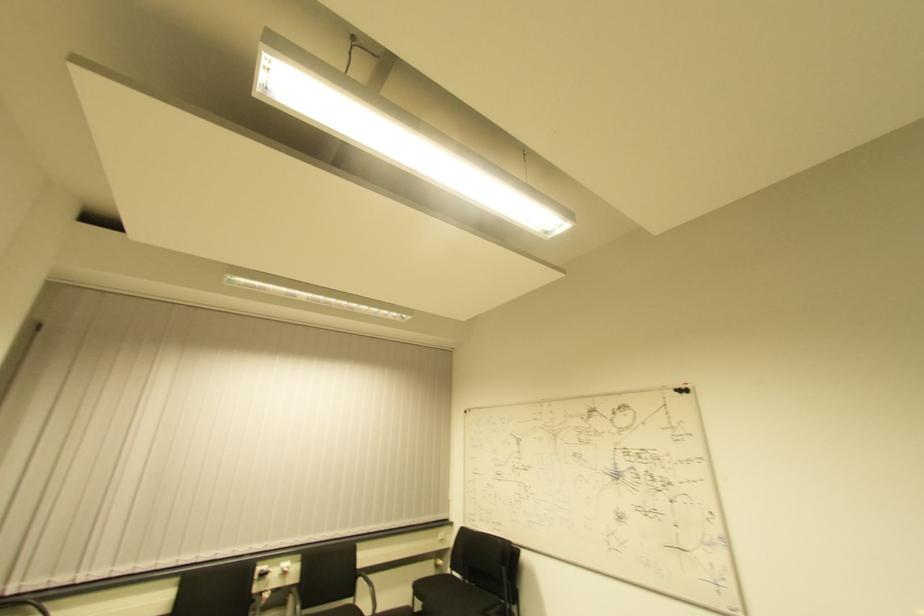
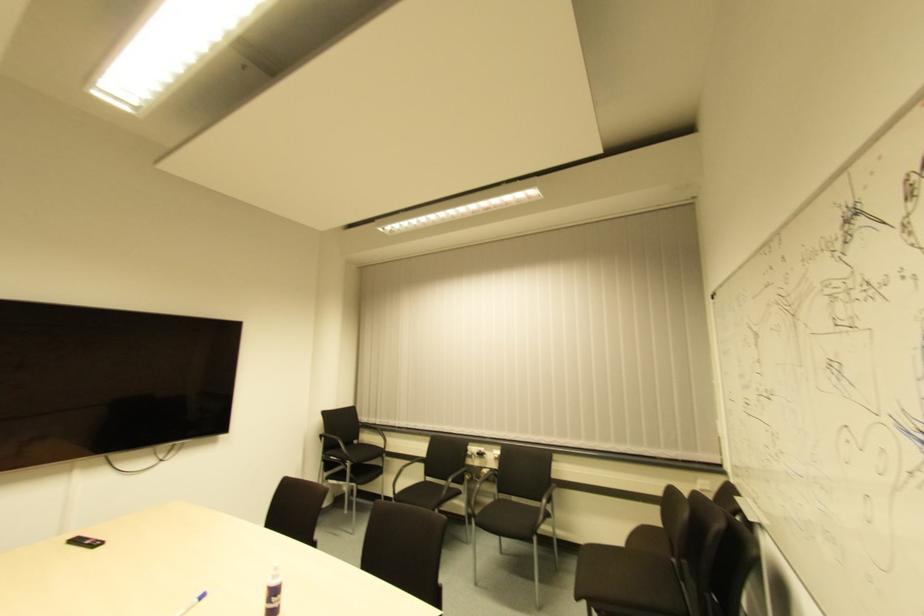
In the second image, find the point that corresponds to [283,576] in the first image.

(494, 462)